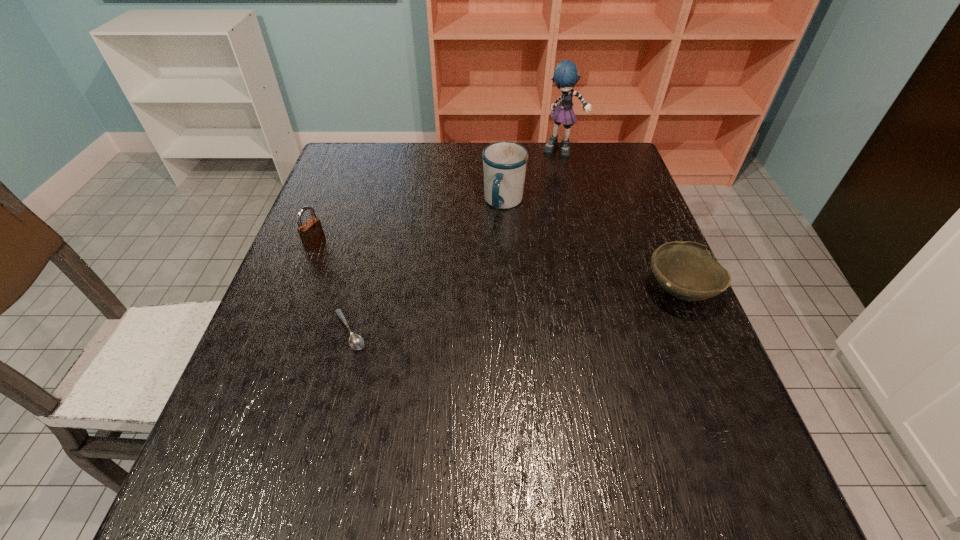
Where is `vacant area between the third tallest object and the rag doll`? vacant area between the third tallest object and the rag doll is located at coordinates (439, 197).

The height and width of the screenshot is (540, 960). What are the coordinates of `free space between the fourth nearest object and the rightmost object` in the screenshot? It's located at (592, 246).

The image size is (960, 540). I want to click on vacant area between the rightmost object and the fourth shortest object, so click(592, 246).

Locate an element on the screen. This screenshot has width=960, height=540. empty location between the fourth shortest object and the rag doll is located at coordinates (533, 177).

Select which object appears as the closest to the rag doll. Please provide its 2D coordinates. Your answer should be formatted as a tuple, i.e. [(x, y)], where the tuple contains the x and y coordinates of a point satisfying the conditions above.

[(504, 163)]

Identify the location of object identified as the fourth closest to the mug. click(311, 232).

Find the location of a particular element. vacant area that satisfies the following two spatial constraints: 1. on the back side of the third object from left to right; 2. on the left side of the fourth object from right to left is located at coordinates (382, 202).

What are the coordinates of `free space that satisfies the following two spatial constraints: 1. on the back side of the farthest object; 2. on the right side of the third nearest object` in the screenshot? It's located at (351, 150).